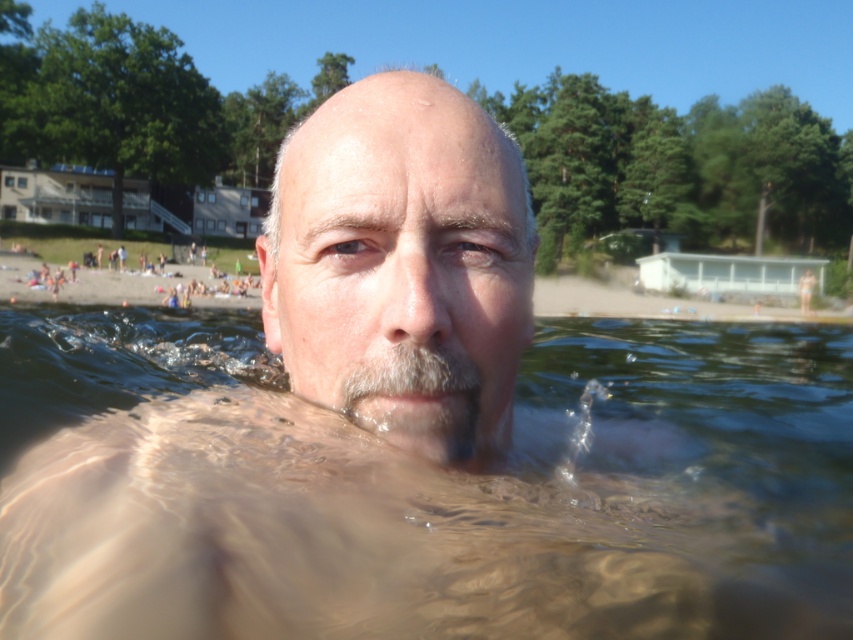
Based on the scene description, can you determine if the smooth skin face at center is wider than the gray matte beard at center?

The smooth skin face at center might be wider than gray matte beard at center according to the description.

You are a photographer trying to capture a portrait of the person in the water. You notice the smooth skin face at center and the gray matte beard at center. Which facial feature is positioned further to the right?

The gray matte beard at center is positioned further to the right because the smooth skin face at center is to the left of it.